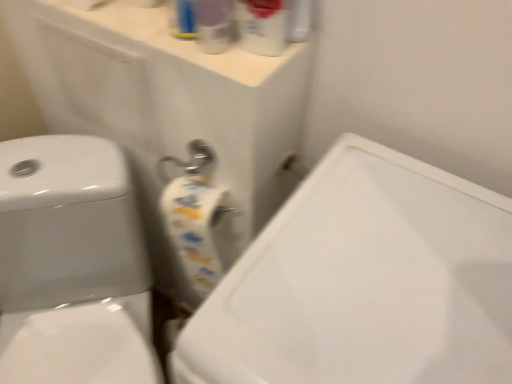
What are the coordinates of `free region on the left part of translucent plastic spray bottle at upper center, the second cleaning product when ordered from right to left` in the screenshot? It's located at (135, 34).